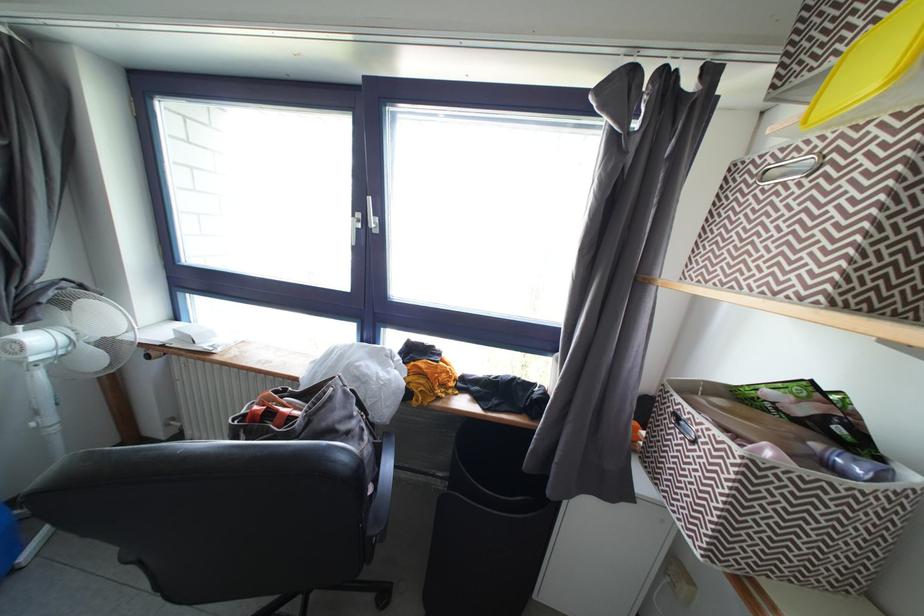
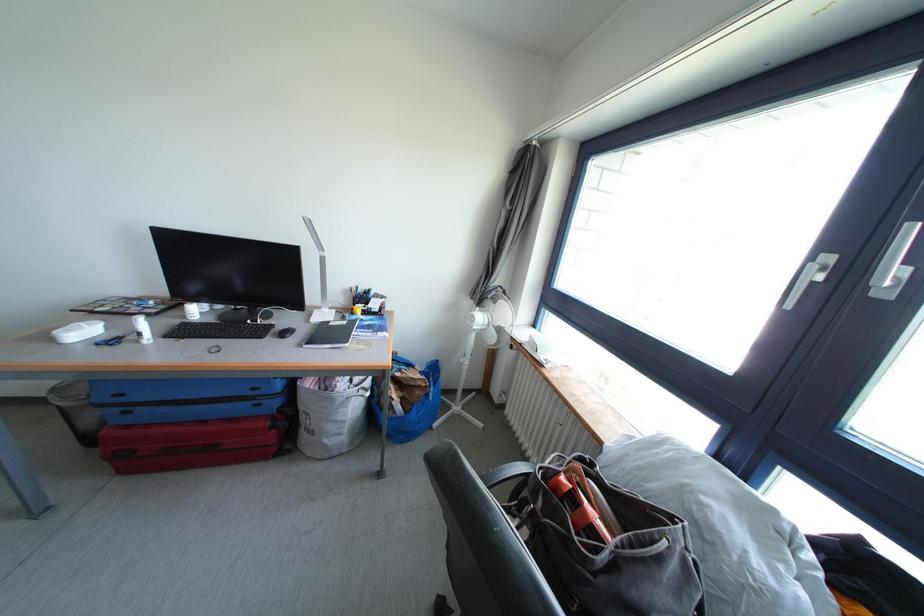
The point at [380,231] is marked in the first image. Where is the corresponding point in the second image?

(894, 288)